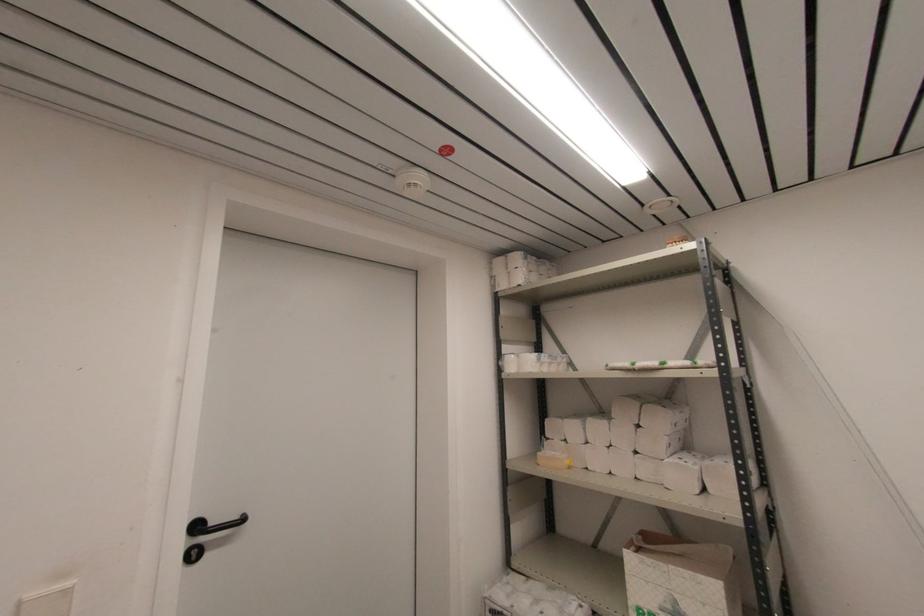
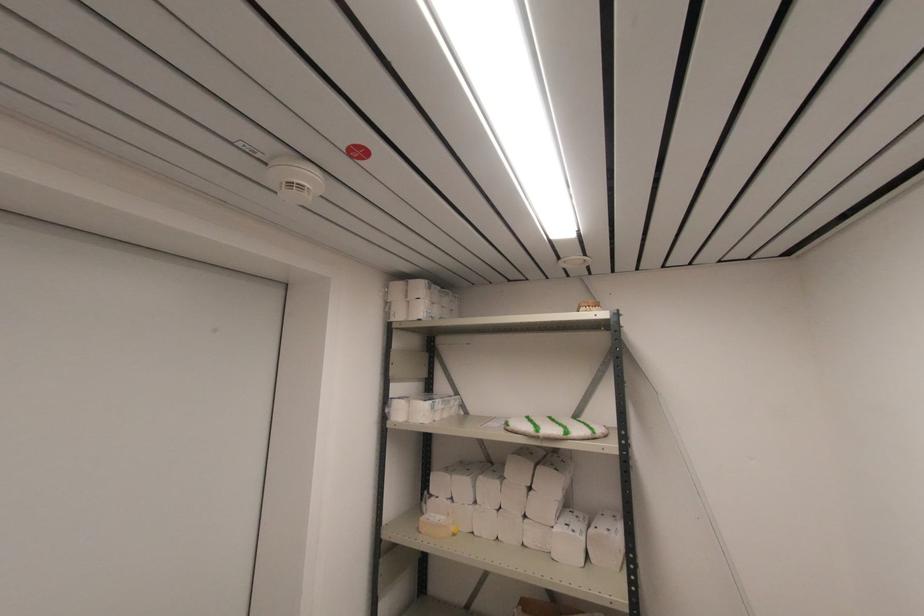
Where in the second image is the point corresponding to (540,464) from the first image?

(420, 533)